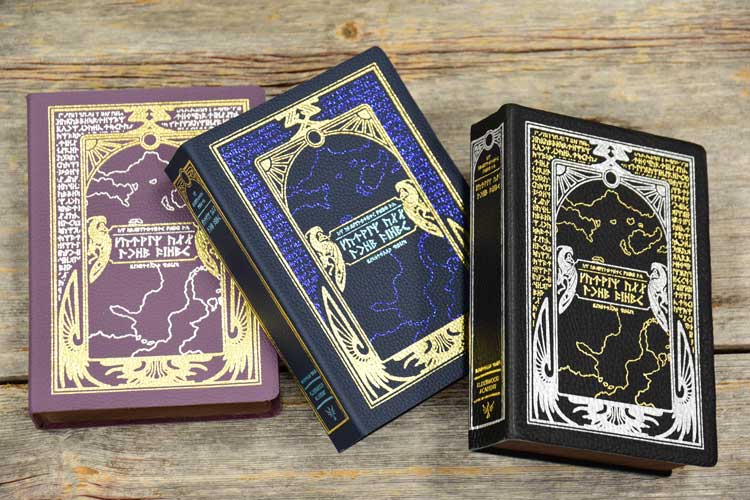
What are the coordinates of `wooden surface` in the screenshot? It's located at (458, 103).